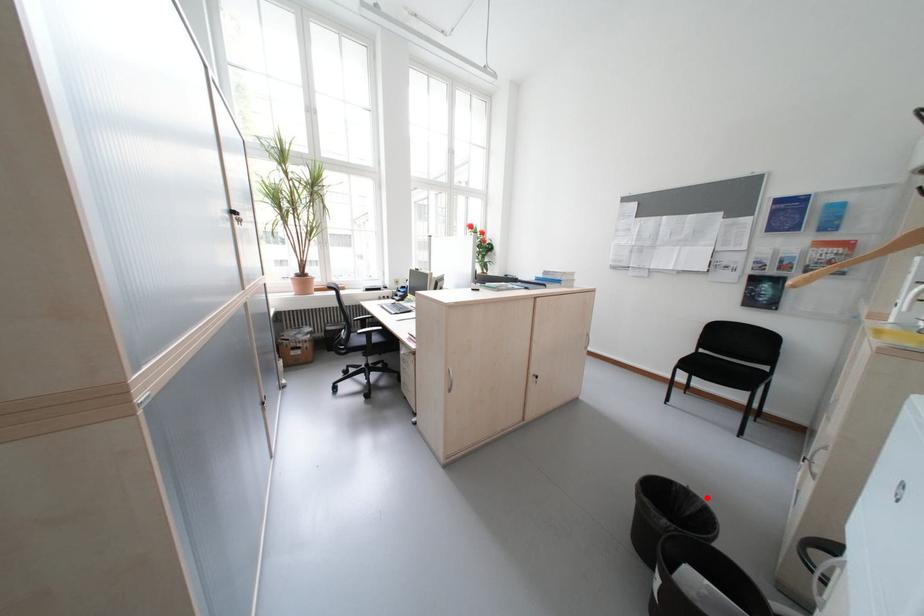
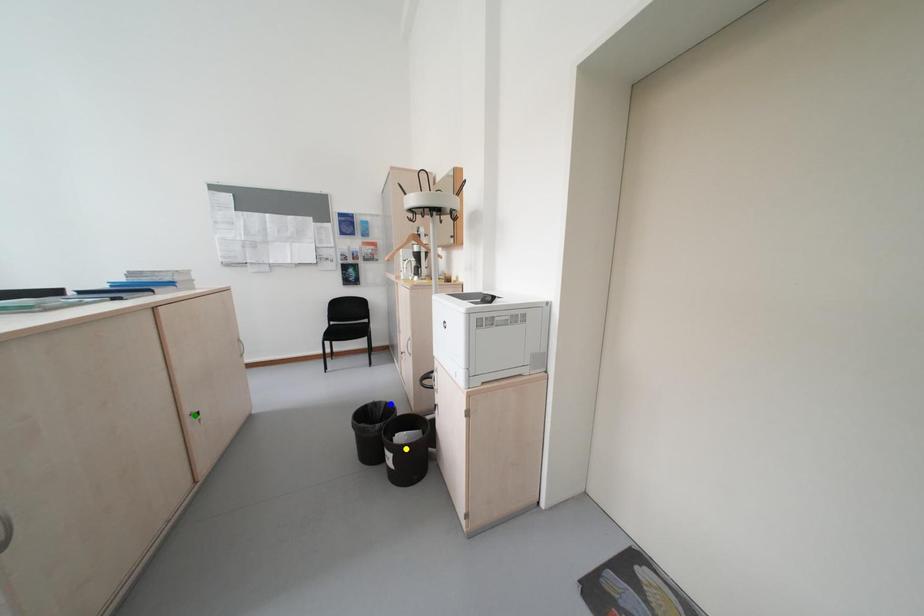
Question: I am providing you with two images of the same scene from different viewpoints. A red point is marked on the first image. You are given multiple points on the second image. Which spot in image 2 lines up with the point in image 1?

Choices:
 (A) yellow point
 (B) blue point
 (C) green point

Answer: (B)